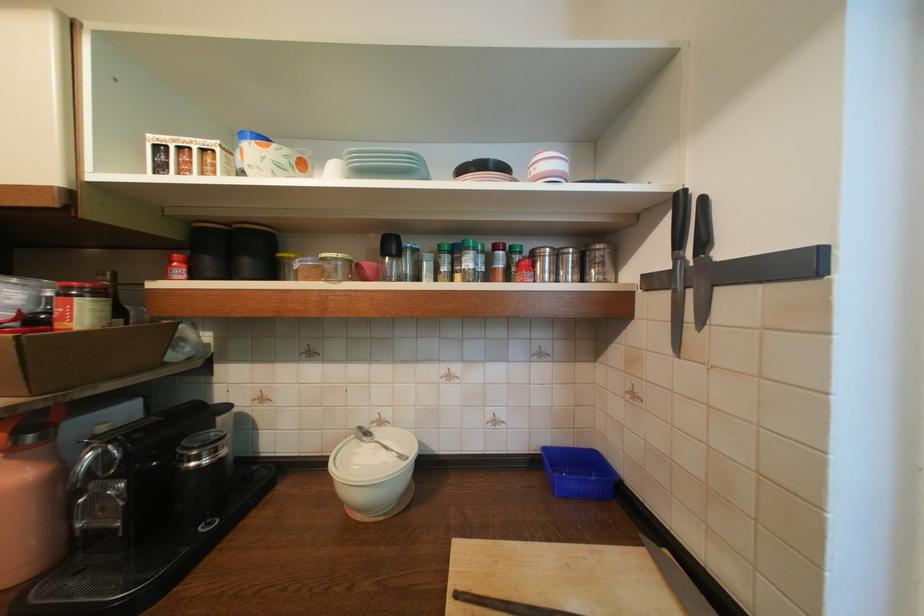
In order to click on black canister in this screenshot , I will do `click(204, 477)`.